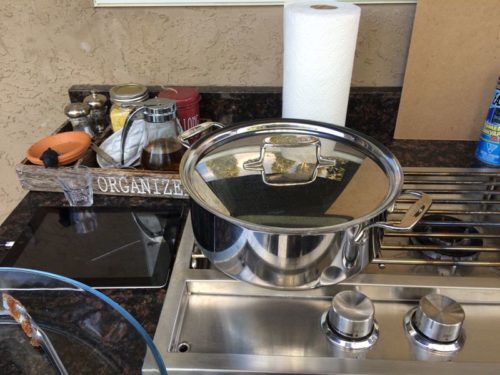
Find the location of `pot`. pot is located at coordinates pyautogui.click(x=296, y=248).